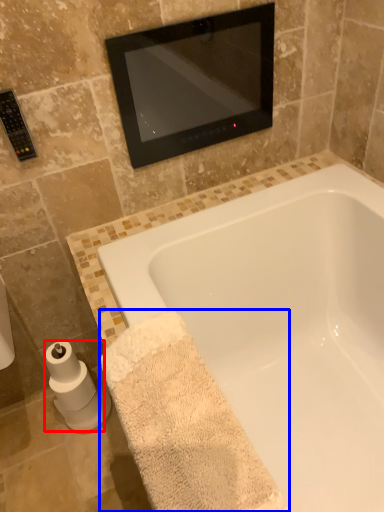
Question: Which object is further to the camera taking this photo, toilet paper (highlighted by a red box) or bath towel (highlighted by a blue box)?

Choices:
 (A) toilet paper
 (B) bath towel

Answer: (A)